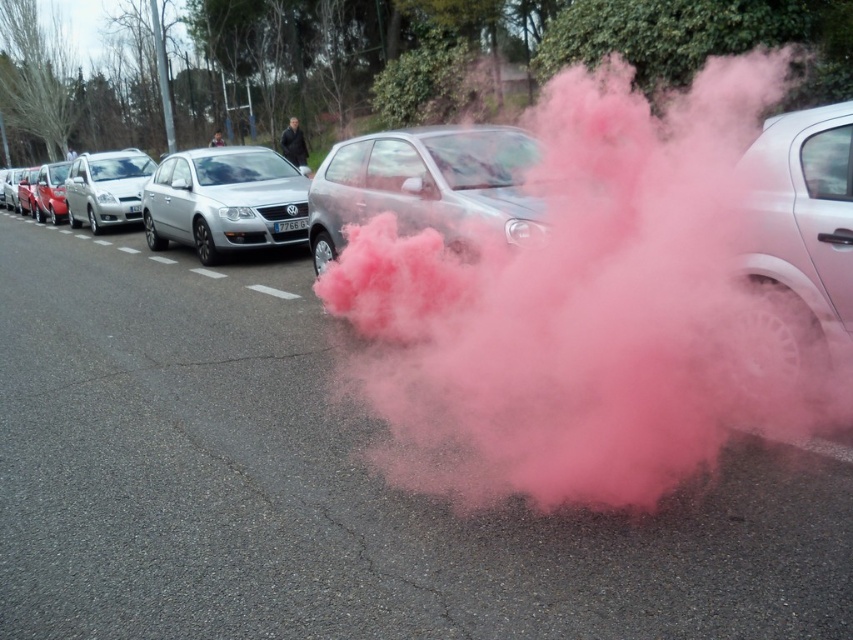
Question: Which point appears farthest from the camera in this image?

Choices:
 (A) (469, 544)
 (B) (300, 193)
 (C) (849, 298)

Answer: (B)

Question: Can you confirm if pink smoke at center is positioned above white metallic car at right?

Choices:
 (A) no
 (B) yes

Answer: (A)

Question: In this image, where is satin silver hatchback at center located relative to satin silver hatchback at left?

Choices:
 (A) above
 (B) below

Answer: (B)

Question: Among these objects, which one is farthest from the camera?

Choices:
 (A) satin silver car at center
 (B) satin silver hatchback at center
 (C) pink powder cloud at center

Answer: (A)

Question: Does pink powder cloud at center appear over white metallic car at right?

Choices:
 (A) yes
 (B) no

Answer: (A)

Question: Estimate the real-world distances between objects in this image. Which object is farther from the satin silver car at center?

Choices:
 (A) pink powder cloud at center
 (B) pink smoke at center
 (C) satin silver hatchback at left
 (D) white metallic car at right

Answer: (A)